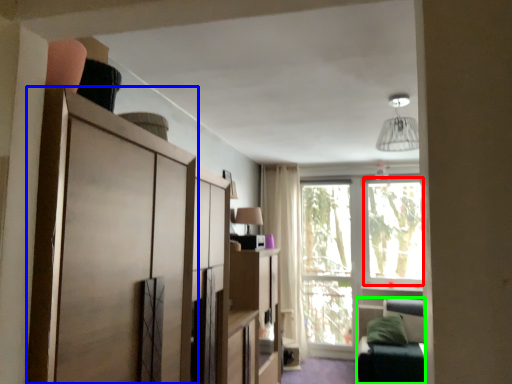
Question: Which is farther away from window screen (highlighted by a red box)? cabinetry (highlighted by a blue box) or bunk bed (highlighted by a green box)?

Choices:
 (A) cabinetry
 (B) bunk bed

Answer: (A)